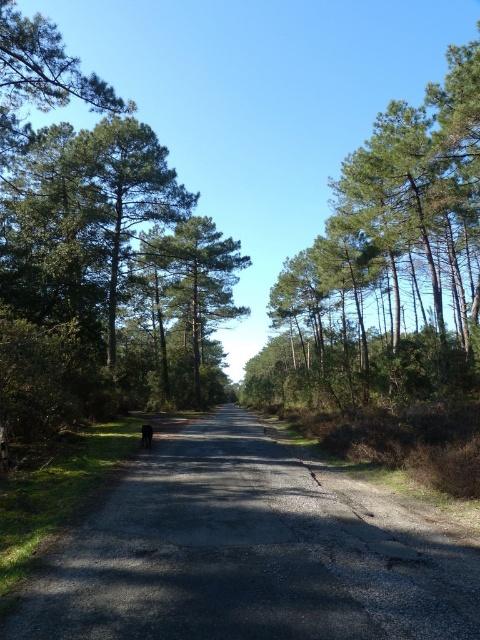
You are driving along the dirt road at center and want to park near the green leafy tree at upper right. Based on the scene description, which direction should you turn to reach the tree?

The dirt road at center is to the left of green leafy tree at upper right, so you should turn to the right to reach the tree.

You are a hiker walking along the dirt road at center and see the green leafy tree at upper right. Which direction should you walk to get closer to the tree?

To get closer to the green leafy tree at upper right, you should walk forward along the dirt road at center since it is located below the tree, meaning the tree is ahead in the direction the road leads.

Based on the photo, you are a hiker walking along the dirt road at center. You notice the green matte tree at center above you. Is the tree directly above the road or on the side?

The dirt road at center is positioned under green matte tree at center, so the tree is directly above the road.